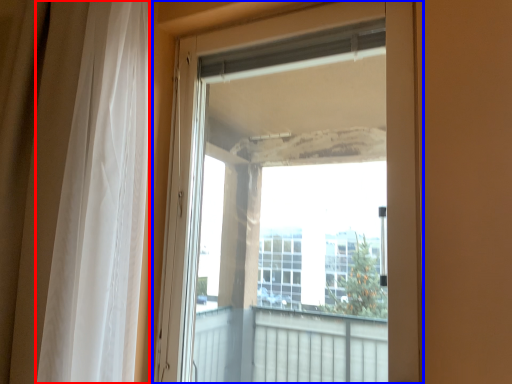
Question: Among these objects, which one is nearest to the camera, curtain (highlighted by a red box) or door (highlighted by a blue box)?

Choices:
 (A) curtain
 (B) door

Answer: (A)